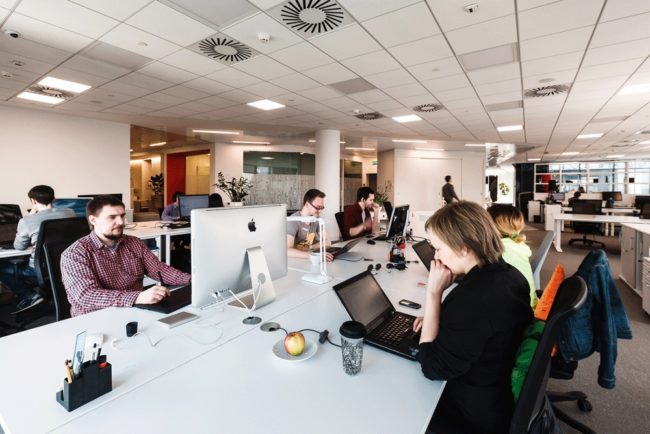
Locate an element on the screen. desks is located at coordinates (612, 219), (642, 230), (621, 209), (317, 312), (296, 292), (341, 265), (393, 285), (174, 233), (10, 255).